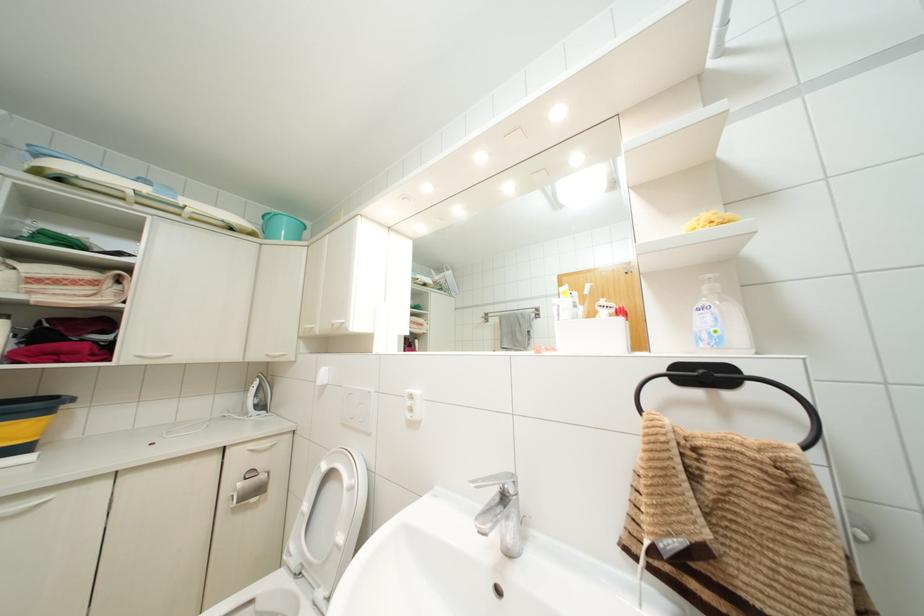
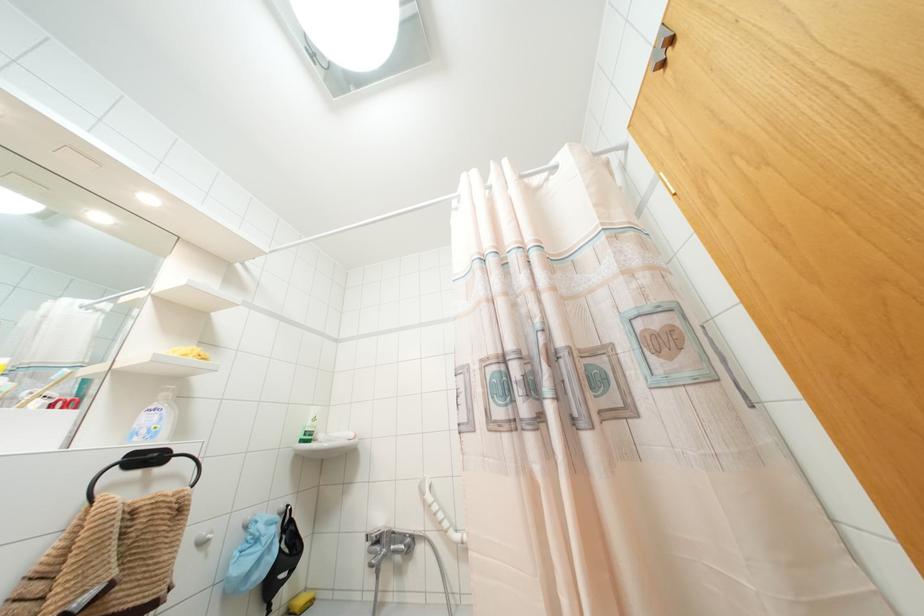
Where in the second image is the point corresponding to point 703,375 from the first image?

(147, 458)